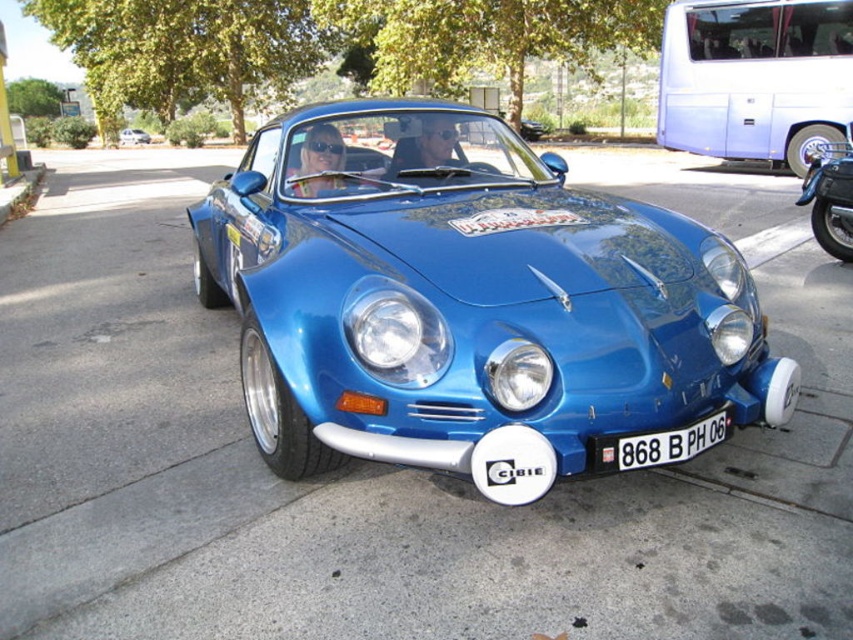
Who is higher up, shiny blue car at center or white plastic license plate at center?

shiny blue car at center

Identify the location of shiny blue car at center. Image resolution: width=853 pixels, height=640 pixels. click(x=467, y=301).

Find the location of `shiny blue car at center`. shiny blue car at center is located at coordinates (467, 301).

Who is lower down, white metallic bus at upper right or white plastic license plate at center?

white plastic license plate at center

Who is more forward, (747,157) or (712,428)?

Point (712,428) is more forward.

Locate an element on the screen. The image size is (853, 640). white metallic bus at upper right is located at coordinates (755, 77).

Is blue metallic motorcycle at right below metallic blue car at center?

Correct, blue metallic motorcycle at right is located below metallic blue car at center.

Can you confirm if blue metallic motorcycle at right is positioned to the right of metallic blue car at center?

Correct, you'll find blue metallic motorcycle at right to the right of metallic blue car at center.

Is point (833, 209) more distant than point (129, 129)?

No, it is not.

This screenshot has height=640, width=853. I want to click on blue metallic motorcycle at right, so click(830, 195).